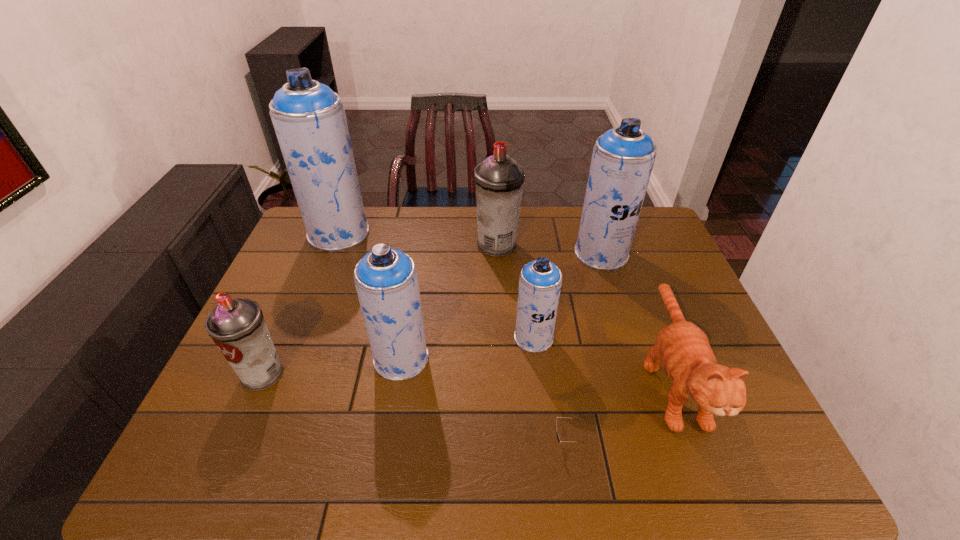
This screenshot has width=960, height=540. Find the location of `vacant space that is in between the nearer gray aerosol can and the third aerosol can from left to right`. vacant space that is in between the nearer gray aerosol can and the third aerosol can from left to right is located at coordinates (332, 366).

The width and height of the screenshot is (960, 540). Find the location of `free space between the tallest object and the bigger gray aerosol can`. free space between the tallest object and the bigger gray aerosol can is located at coordinates [418, 239].

Where is `vacant space that's between the farther gray aerosol can and the leftmost blue aerosol can`? The image size is (960, 540). vacant space that's between the farther gray aerosol can and the leftmost blue aerosol can is located at coordinates (x=418, y=239).

The width and height of the screenshot is (960, 540). Find the location of `free spot between the leftmost blue aerosol can and the second shortest object`. free spot between the leftmost blue aerosol can and the second shortest object is located at coordinates (505, 306).

Locate which object is the closest to the seventh tallest object. Please provide its 2D coordinates. Your answer should be formatted as a tuple, i.e. [(x, y)], where the tuple contains the x and y coordinates of a point satisfying the conditions above.

[(558, 438)]

Identify which object is the seventh closest to the bigger gray aerosol can. Please provide its 2D coordinates. Your answer should be formatted as a tuple, i.e. [(x, y)], where the tuple contains the x and y coordinates of a point satisfying the conditions above.

[(237, 326)]

You are a GUI agent. You are given a task and a screenshot of the screen. Output one action in this format:
    pyautogui.click(x=<x>, y=<y>)
    Task: Click on the aerosol can that is the fourth closest one to the second blue aerosol can from left to right
    The image size is (960, 540).
    Given the screenshot: What is the action you would take?
    pyautogui.click(x=309, y=119)

Locate which aerosol can is the fourth closest to the nearer gray aerosol can. Please provide its 2D coordinates. Your answer should be formatted as a tuple, i.e. [(x, y)], where the tuple contains the x and y coordinates of a point satisfying the conditions above.

[(499, 180)]

Locate which blue aerosol can is the second closest to the third biggest blue aerosol can. Please provide its 2D coordinates. Your answer should be formatted as a tuple, i.e. [(x, y)], where the tuple contains the x and y coordinates of a point satisfying the conditions above.

[(309, 119)]

Locate which blue aerosol can is the third closest to the fifth shortest aerosol can. Please provide its 2D coordinates. Your answer should be formatted as a tuple, i.e. [(x, y)], where the tuple contains the x and y coordinates of a point satisfying the conditions above.

[(309, 119)]